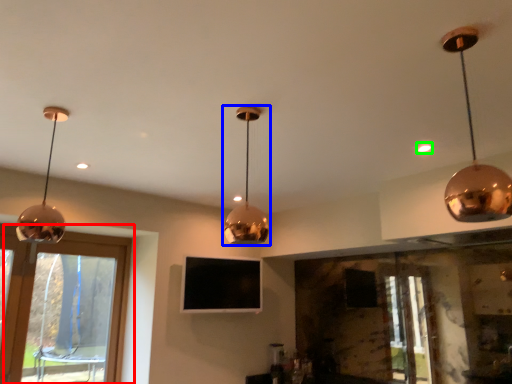
Question: Which is farther away from window (highlighted by a red box)? lamp (highlighted by a blue box) or glow (highlighted by a green box)?

Choices:
 (A) lamp
 (B) glow

Answer: (B)